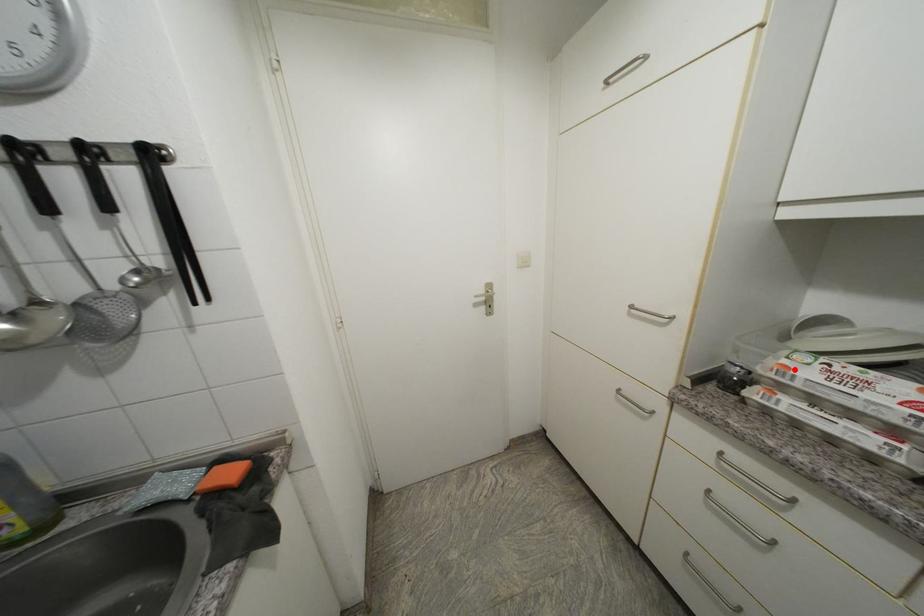
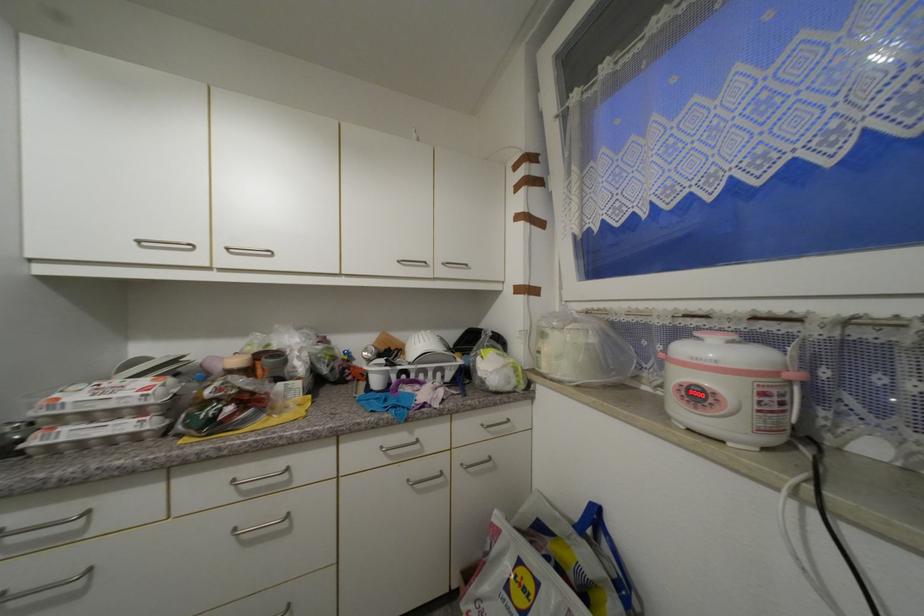
In the second image, find the point that corresponds to the highlighted location in the first image.

(64, 400)